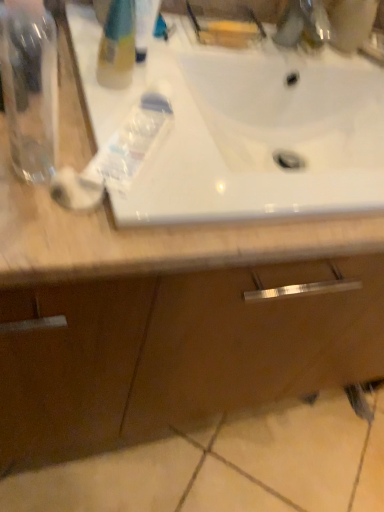
Image resolution: width=384 pixels, height=512 pixels. Describe the element at coordinates (133, 142) in the screenshot. I see `translucent plastic toothpaste at center` at that location.

Find the location of a particular element. This screenshot has height=512, width=384. transparent plastic bottle at left is located at coordinates (30, 91).

What do you see at coordinates (303, 24) in the screenshot?
I see `metallic faucet at upper right` at bounding box center [303, 24].

This screenshot has height=512, width=384. What do you see at coordinates (244, 130) in the screenshot?
I see `white glossy sink at upper center` at bounding box center [244, 130].

What is the approximate width of translucent plastic bottle at upper left?

translucent plastic bottle at upper left is 2.23 inches wide.

Where is `translucent plastic toothpaste at center`? The height and width of the screenshot is (512, 384). translucent plastic toothpaste at center is located at coordinates (133, 142).

Is translucent plastic bottle at upper left positioned with its back to white glossy sink at upper center?

That's not correct — translucent plastic bottle at upper left is not looking away from white glossy sink at upper center.

Is translucent plastic bottle at upper left next to white glossy sink at upper center?

No, translucent plastic bottle at upper left is not touching white glossy sink at upper center.

From the image's perspective, is translucent plastic bottle at upper left located above or below white glossy sink at upper center?

translucent plastic bottle at upper left is situated higher than white glossy sink at upper center in the image.

From the image's perspective, which is above, translucent plastic toothpaste at center or metallic faucet at upper right?

metallic faucet at upper right.

Is translucent plastic toothpaste at center at the left side of metallic faucet at upper right?

Correct, you'll find translucent plastic toothpaste at center to the left of metallic faucet at upper right.

Is translucent plastic toothpaste at center inside the boundaries of metallic faucet at upper right, or outside?

translucent plastic toothpaste at center cannot be found inside metallic faucet at upper right.

From the picture: Is translucent plastic toothpaste at center positioned with its back to metallic faucet at upper right?

That's not correct — translucent plastic toothpaste at center is not looking away from metallic faucet at upper right.

Are metallic faucet at upper right and white glossy sink at upper center far apart?

They are positioned close to each other.

Is point (296, 2) closer to camera compared to point (84, 25)?

No, it is behind (84, 25).

Between metallic faucet at upper right and white glossy sink at upper center, which one has larger width?

white glossy sink at upper center is wider.

The image size is (384, 512). In order to click on cleaning product that appears on the left of translucent plastic toothpaste at center in this screenshot , I will do `click(117, 45)`.

Are translucent plastic toothpaste at center and translucent plastic bottle at upper left far apart?

Actually, translucent plastic toothpaste at center and translucent plastic bottle at upper left are a little close together.

Looking at this image, from a real-world perspective, is translucent plastic toothpaste at center above or below translucent plastic bottle at upper left?

translucent plastic toothpaste at center is below translucent plastic bottle at upper left.

In terms of height, does translucent plastic toothpaste at center look taller or shorter compared to translucent plastic bottle at upper left?

translucent plastic toothpaste at center is shorter than translucent plastic bottle at upper left.

Considering the sizes of objects white glossy sink at upper center and translucent plastic toothpaste at center in the image provided, who is smaller, white glossy sink at upper center or translucent plastic toothpaste at center?

translucent plastic toothpaste at center.

Could you tell me if white glossy sink at upper center is facing translucent plastic toothpaste at center?

No, white glossy sink at upper center is not facing towards translucent plastic toothpaste at center.

From the image's perspective, is white glossy sink at upper center located beneath translucent plastic toothpaste at center?

Incorrect, from the image's perspective, white glossy sink at upper center is higher than translucent plastic toothpaste at center.

Based on their sizes in the image, would you say transparent plastic bottle at left is bigger or smaller than translucent plastic bottle at upper left?

transparent plastic bottle at left is smaller than translucent plastic bottle at upper left.

Locate an element on the screen. cleaning product above the transparent plastic bottle at left (from a real-world perspective) is located at coordinates [117, 45].

Does transparent plastic bottle at left have a lesser height compared to translucent plastic bottle at upper left?

No.

Would you say white glossy sink at upper center is outside transparent plastic bottle at left?

Yes.

From the image's perspective, which one is positioned lower, white glossy sink at upper center or transparent plastic bottle at left?

transparent plastic bottle at left appears lower in the image.

Would you say white glossy sink at upper center is to the left or to the right of transparent plastic bottle at left in the picture?

white glossy sink at upper center is to the right of transparent plastic bottle at left.

Identify the location of cleaning product above the white glossy sink at upper center (from a real-world perspective). This screenshot has height=512, width=384. (117, 45).

Image resolution: width=384 pixels, height=512 pixels. Find the location of `plumbing fixture above the translucent plastic toothpaste at center (from the image's perspective)`. plumbing fixture above the translucent plastic toothpaste at center (from the image's perspective) is located at coordinates (303, 24).

From the image, which object appears to be nearer to metallic faucet at upper right, transparent plastic bottle at left or white glossy sink at upper center?

white glossy sink at upper center is positioned closer to the anchor metallic faucet at upper right.

Considering their positions, is translucent plastic toothpaste at center positioned further to translucent plastic bottle at upper left than transparent plastic bottle at left?

The object further to translucent plastic bottle at upper left is transparent plastic bottle at left.

Consider the image. When comparing their distances from transparent plastic bottle at left, does translucent plastic bottle at upper left or translucent plastic toothpaste at center seem closer?

Based on the image, translucent plastic toothpaste at center appears to be nearer to transparent plastic bottle at left.

Looking at the image, which one is located further to white glossy sink at upper center, metallic faucet at upper right or transparent plastic bottle at left?

Based on the image, transparent plastic bottle at left appears to be further to white glossy sink at upper center.

From the image, which object appears to be farther from white glossy sink at upper center, transparent plastic bottle at left or translucent plastic toothpaste at center?

Among the two, transparent plastic bottle at left is located further to white glossy sink at upper center.

Which object lies further to the anchor point white glossy sink at upper center, translucent plastic toothpaste at center or metallic faucet at upper right?

translucent plastic toothpaste at center.

Which object lies further to the anchor point translucent plastic toothpaste at center, white glossy sink at upper center or transparent plastic bottle at left?

Among the two, white glossy sink at upper center is located further to translucent plastic toothpaste at center.

Which object lies nearer to the anchor point metallic faucet at upper right, translucent plastic toothpaste at center or transparent plastic bottle at left?

translucent plastic toothpaste at center is closer to metallic faucet at upper right.

The width and height of the screenshot is (384, 512). I want to click on toothpaste located between translucent plastic bottle at upper left and metallic faucet at upper right in the left-right direction, so [x=133, y=142].

The height and width of the screenshot is (512, 384). I want to click on sink positioned between translucent plastic toothpaste at center and metallic faucet at upper right from near to far, so (244, 130).

Identify the location of sink located between translucent plastic bottle at upper left and metallic faucet at upper right in the left-right direction. (244, 130).

This screenshot has width=384, height=512. In order to click on bottle that lies between translucent plastic bottle at upper left and translucent plastic toothpaste at center from top to bottom in this screenshot , I will do `click(30, 91)`.